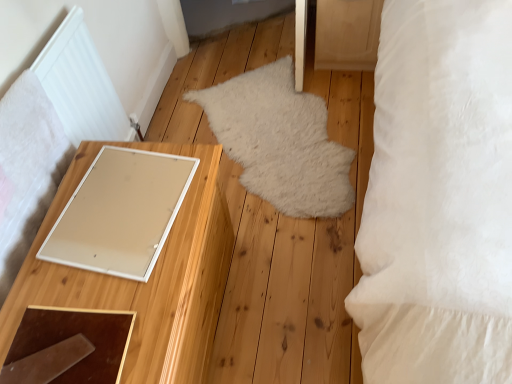
In order to click on vacant space underneath white glossy board at left (from a real-world perspective) in this screenshot , I will do (x=118, y=199).